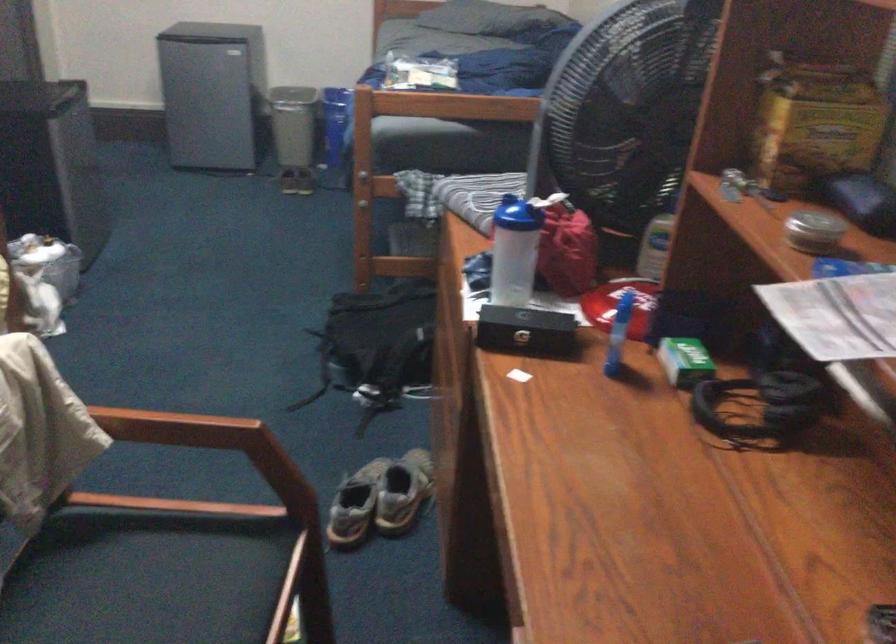
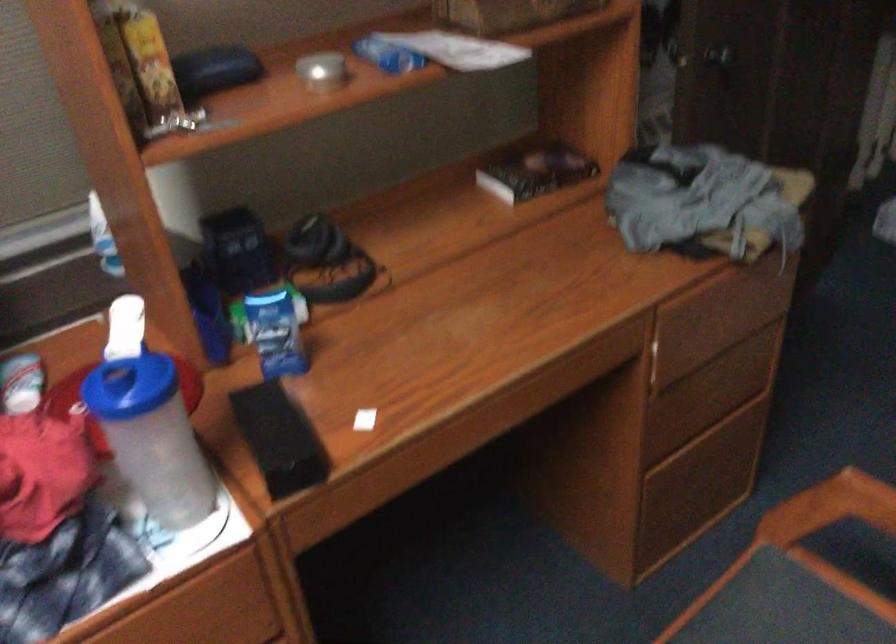
Locate, in the second image, the point that corresponds to (x=504, y=324) in the first image.

(279, 438)